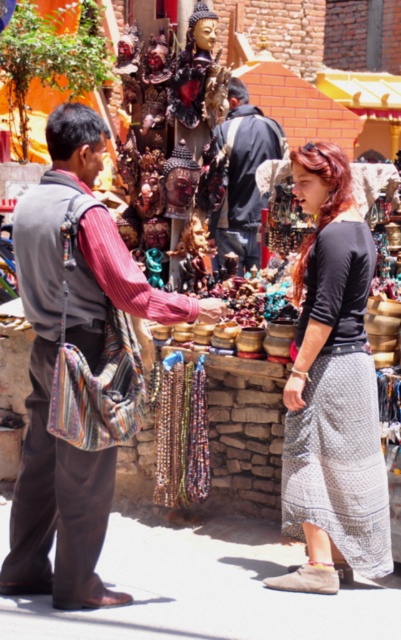
Question: Which of the following is the farthest from the observer?

Choices:
 (A) (164, 388)
 (B) (74, 291)
 (C) (305, 416)
 (D) (263, 208)

Answer: (D)

Question: In this image, where is dark blue fabric jacket at center located relative to multicolored beaded necklace at center?

Choices:
 (A) right
 (B) left

Answer: (A)

Question: Is knitted fabric bag at left closer to camera compared to multicolored beaded necklace at center?

Choices:
 (A) yes
 (B) no

Answer: (A)

Question: Which is farther from the dark blue fabric jacket at center?

Choices:
 (A) knitted fabric bag at left
 (B) multicolored beaded necklace at center
 (C) black cotton skirt at center

Answer: (A)

Question: Which object is farther from the camera taking this photo?

Choices:
 (A) black cotton skirt at center
 (B) knitted fabric bag at left
 (C) dark blue fabric jacket at center

Answer: (C)

Question: In this image, where is knitted fabric bag at left located relative to dark blue fabric jacket at center?

Choices:
 (A) below
 (B) above

Answer: (A)